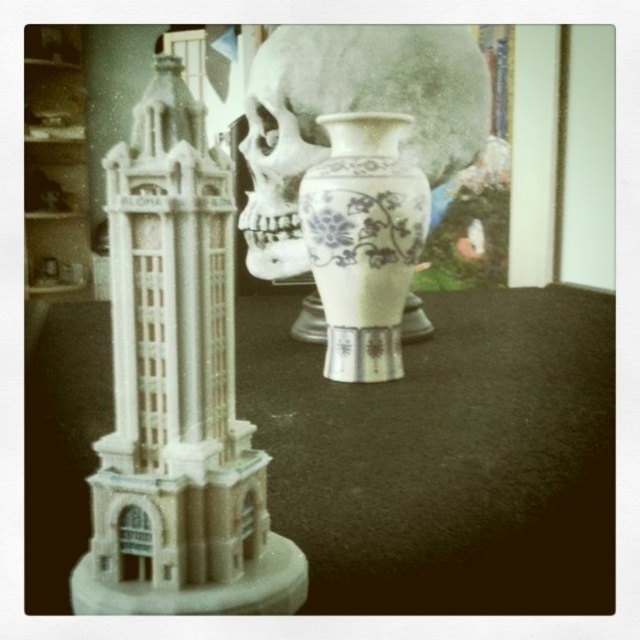
Is white matte tower at left to the right of white porcelain vase at center from the viewer's perspective?

No, white matte tower at left is not to the right of white porcelain vase at center.

Is white matte tower at left bigger than white porcelain vase at center?

Correct, white matte tower at left is larger in size than white porcelain vase at center.

Locate an element on the screen. This screenshot has height=640, width=640. white matte tower at left is located at coordinates (177, 388).

Where is `white matte tower at left`? Image resolution: width=640 pixels, height=640 pixels. white matte tower at left is located at coordinates point(177,388).

Can you confirm if white matte tower at left is wider than white glossy skull at center?

Incorrect, white matte tower at left's width does not surpass white glossy skull at center's.

Describe the element at coordinates (177, 388) in the screenshot. The height and width of the screenshot is (640, 640). I see `white matte tower at left` at that location.

Where is `white matte tower at left`? This screenshot has height=640, width=640. white matte tower at left is located at coordinates point(177,388).

Does point (458, 99) come behind point (364, 332)?

Yes, point (458, 99) is farther from viewer.

Based on the photo, who is positioned more to the left, white glossy skull at center or white porcelain vase at center?

white glossy skull at center is more to the left.

You are a GUI agent. You are given a task and a screenshot of the screen. Output one action in this format:
    pyautogui.click(x=<x>, y=<y>)
    Task: Click on the white glossy skull at center
    The width and height of the screenshot is (640, 640).
    Given the screenshot: What is the action you would take?
    pyautogui.click(x=352, y=112)